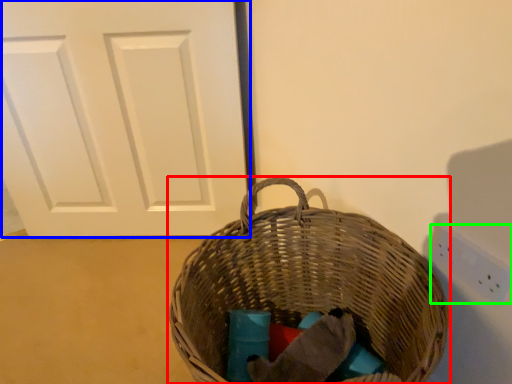
Question: Considering the real-world distances, which object is closest to picnic basket (highlighted by a red box)? door (highlighted by a blue box) or electric outlet (highlighted by a green box).

Choices:
 (A) door
 (B) electric outlet

Answer: (B)